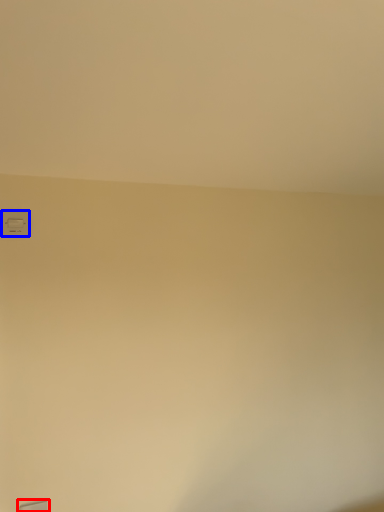
Question: Which object appears farthest to the camera in this image, window (highlighted by a red box) or light switch (highlighted by a blue box)?

Choices:
 (A) window
 (B) light switch

Answer: (B)